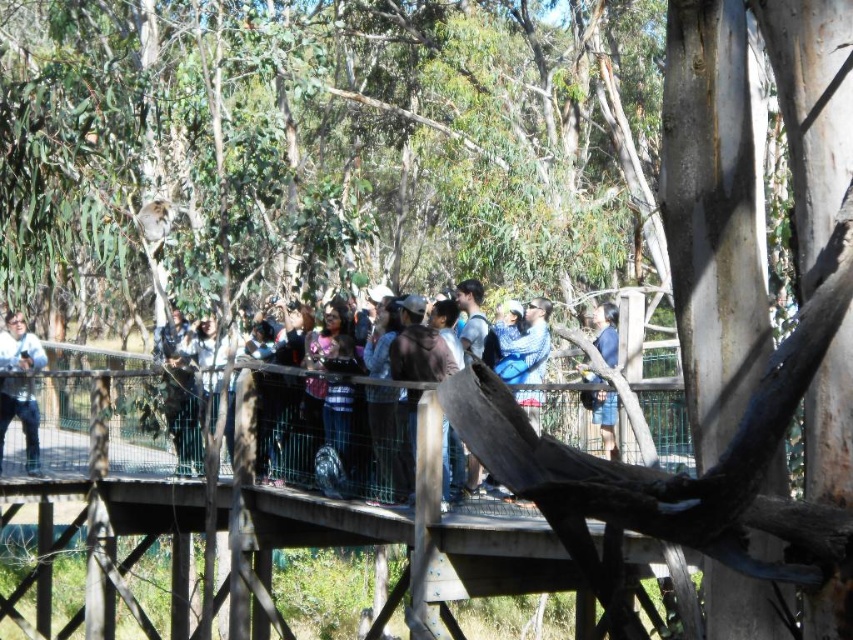
You are a photographer standing on the wooden platform and want to take a photo of both the dark blue jeans at center and the blue denim shorts at center. Which one should you focus on first to ensure both are in the frame?

You should focus on the dark blue jeans at center first since it is closer to you than the blue denim shorts at center, ensuring both are in the frame.

You are standing on the wooden bridge at center and want to reach the matte black jacket at center. Which direction should you move to get closer to the jacket?

The wooden bridge at center is below the matte black jacket at center, so you should move upward to reach the matte black jacket at center.